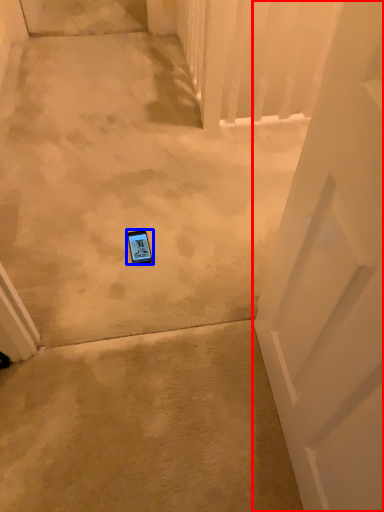
Question: Which point is further to the camera, door (highlighted by a red box) or gadget (highlighted by a blue box)?

Choices:
 (A) door
 (B) gadget

Answer: (B)